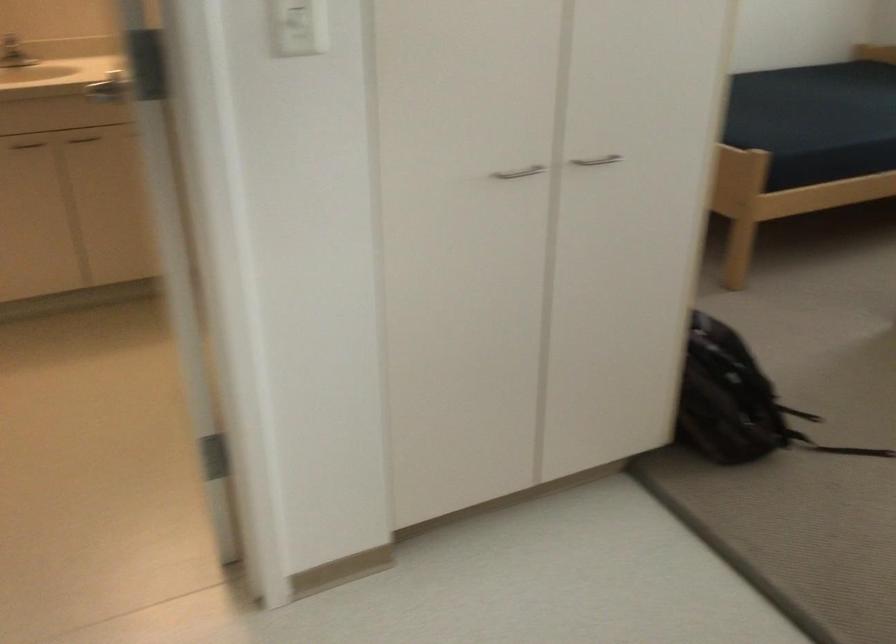
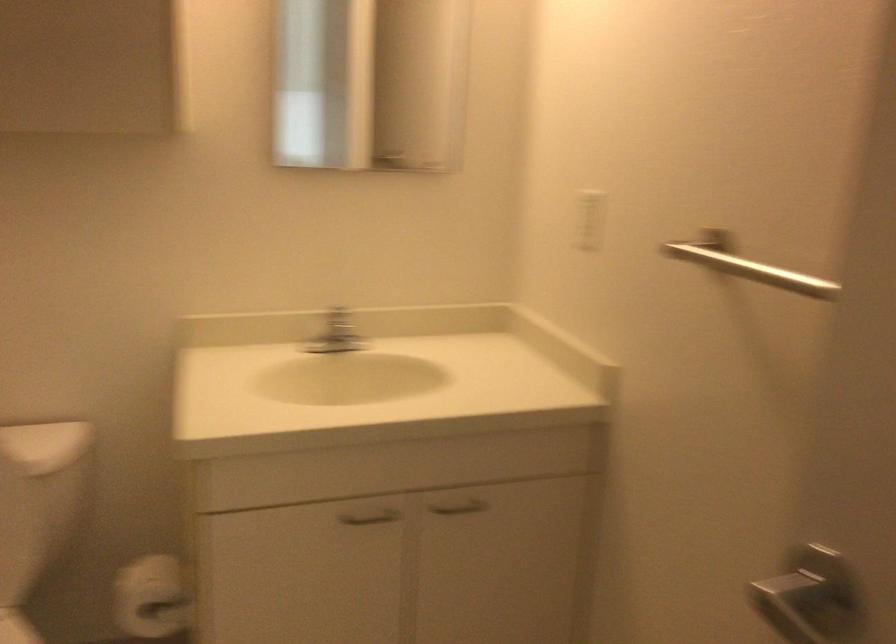
The images are taken continuously from a first-person perspective. In which direction are you moving?

The cameraman walked toward left, forward.